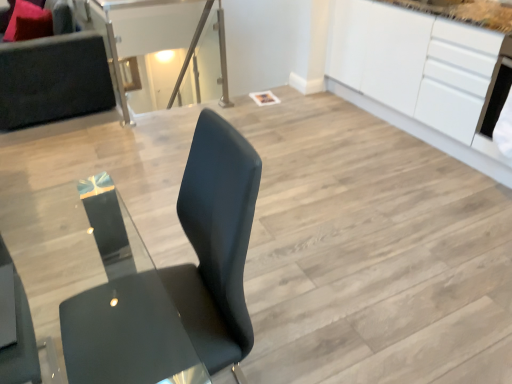
This screenshot has height=384, width=512. I want to click on free space on the front side of transparent glass table at upper center, so click(149, 144).